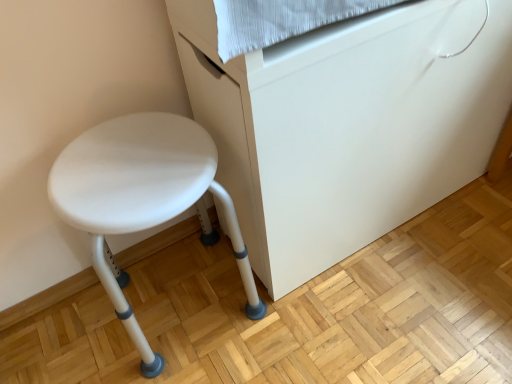
Locate an element on the screen. vacant space underneath white plastic stool at left (from a real-world perspective) is located at coordinates (183, 299).